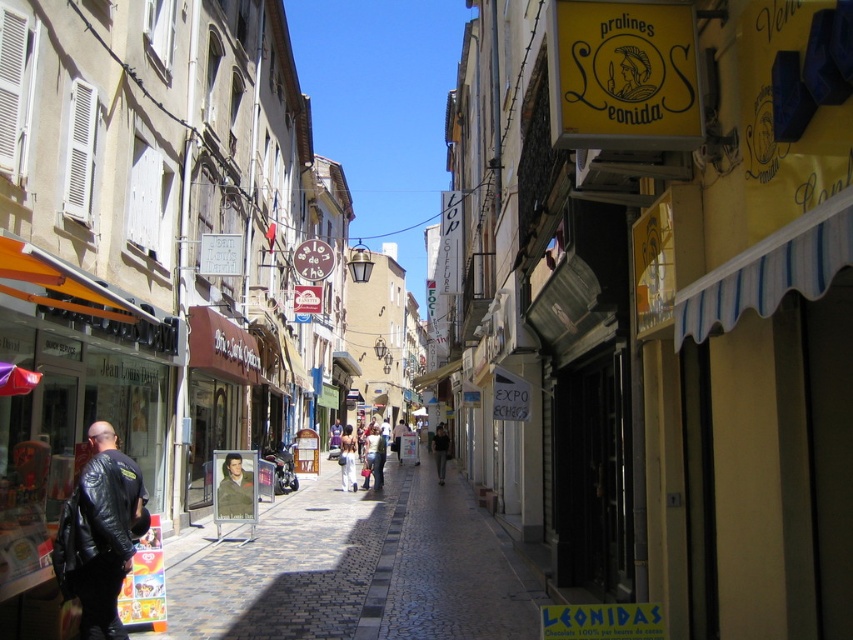
You are a delivery person who needs to place a small package between the black leather jacket at lower left and the light blue jeans at center. Can the package fit between them if the package is 1 inch thick?

The black leather jacket at lower left is thinner than the light blue jeans at center. The space between them is at least as wide as the jeans, which are thicker. Since the package is only 1 inch thick, it should fit comfortably between them.